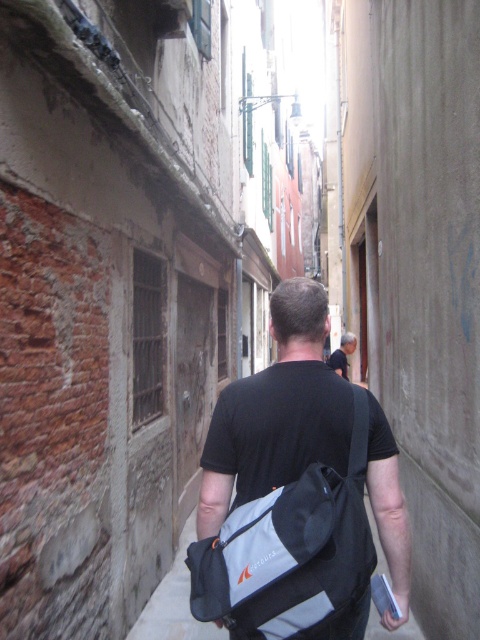
Question: Does black fabric bag at center appear under gray fabric bag at center?

Choices:
 (A) no
 (B) yes

Answer: (A)

Question: Which of the following is the farthest from the observer?

Choices:
 (A) (170, 634)
 (B) (300, 356)
 (C) (330, 362)

Answer: (C)

Question: Which object appears closest to the camera in this image?

Choices:
 (A) dark gray shirt at center
 (B) black fabric bag at center
 (C) gray fabric bag at center

Answer: (B)

Question: Can you confirm if gray fabric bag at center is positioned to the right of dark gray shirt at center?

Choices:
 (A) no
 (B) yes

Answer: (A)

Question: Is black fabric bag at center wider than gray fabric bag at center?

Choices:
 (A) yes
 (B) no

Answer: (A)

Question: Which point is closer to the camera?

Choices:
 (A) (333, 353)
 (B) (301, 282)
 (C) (173, 612)

Answer: (B)